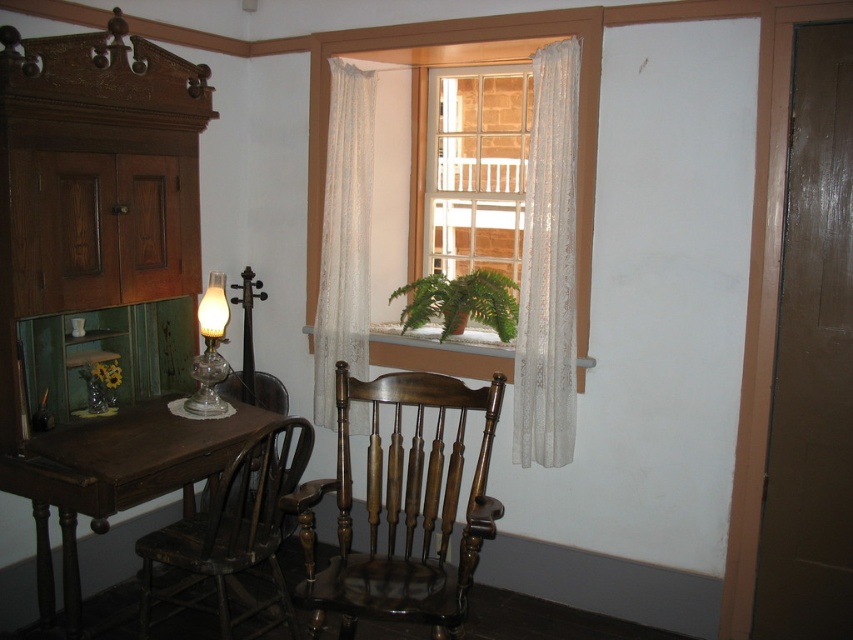
You are standing in the room and want to look out through the clear glass window at center. Based on its position, where should you focus your gaze to see outside?

The clear glass window at center is located at point coordinates of 0.261 on the x axis and 0.558 on the y axis, so you should focus your gaze towards the center area of the room wall at those coordinates to see outside through the clear glass window at center.

You are sitting in the wooden chair in front of the desk. You want to place a small potted plant on the desk so that it is directly in front of you. However, there is already a clear glass window at center and a green matte plant at center on the desk. Can you place the new plant in the desired position without moving the existing items?

The clear glass window at center is positioned over green matte plant at center, meaning the existing green matte plant at center is already directly in front of you. Therefore, you cannot place the new plant in the desired position without moving the existing items.